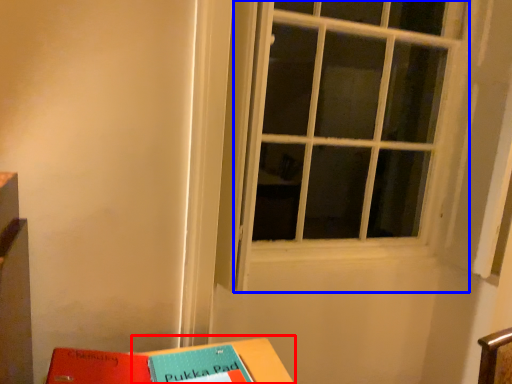
Question: Which object is closer to the camera taking this photo, table (highlighted by a red box) or window (highlighted by a blue box)?

Choices:
 (A) table
 (B) window

Answer: (A)